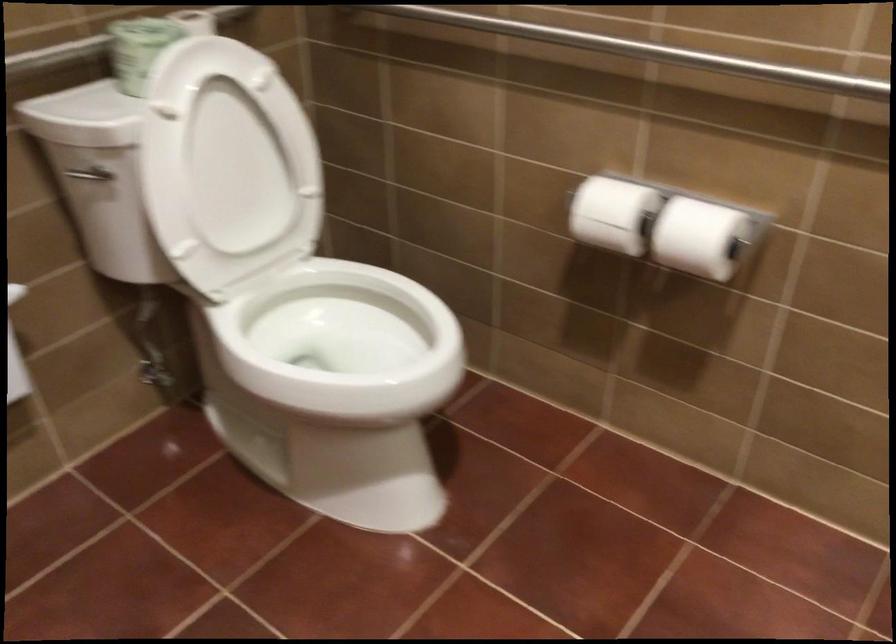
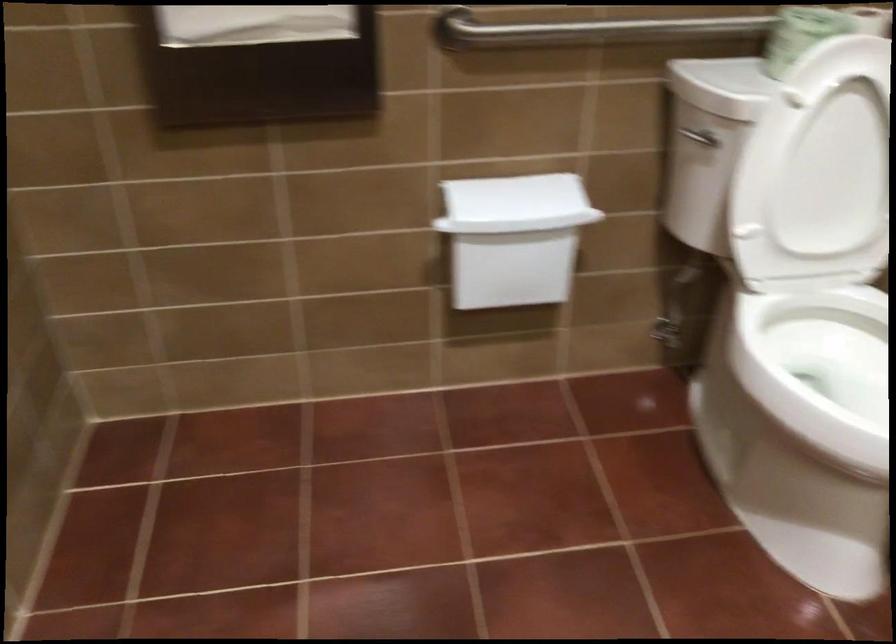
Find the pixel in the second image that matches the point at 311,346 in the first image.

(819, 368)